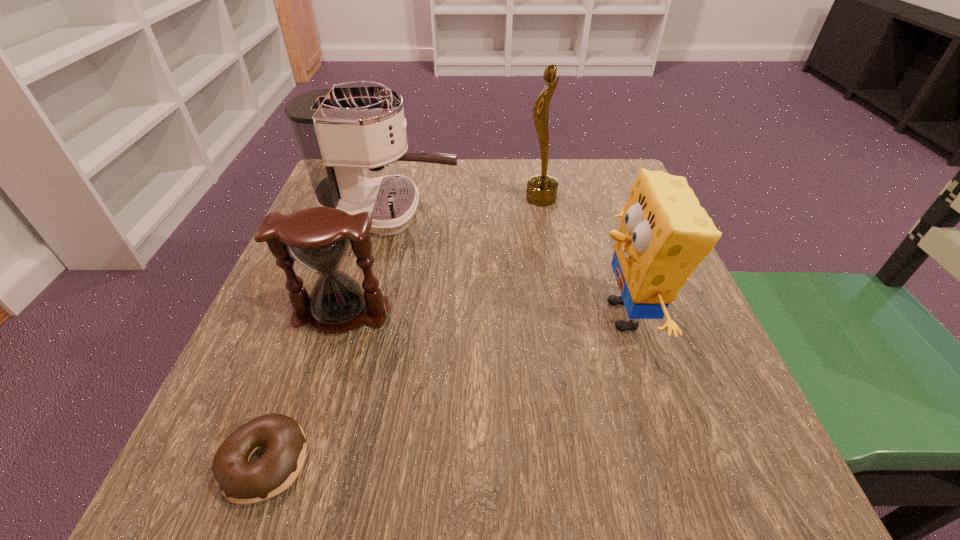
The image size is (960, 540). Find the location of `the second object from right to left`. the second object from right to left is located at coordinates (542, 189).

Identify the location of coffee maker. Image resolution: width=960 pixels, height=540 pixels. tap(339, 131).

Locate an element on the screen. The height and width of the screenshot is (540, 960). the rightmost object is located at coordinates (664, 234).

Locate an element on the screen. The height and width of the screenshot is (540, 960). hourglass is located at coordinates (318, 238).

The width and height of the screenshot is (960, 540). I want to click on the shortest object, so click(241, 482).

Locate an element on the screen. doughnut is located at coordinates (241, 482).

Where is `vacant space located on the front-facing side of the award`? This screenshot has width=960, height=540. vacant space located on the front-facing side of the award is located at coordinates 381,199.

Where is `blank space located 0.360m on the front-facing side of the award`? The height and width of the screenshot is (540, 960). blank space located 0.360m on the front-facing side of the award is located at coordinates (373, 199).

At what (x,y) coordinates should I click in order to perform the action: click on vacant position located on the front-facing side of the award. Please return your answer as a coordinate pair (x, y). Looking at the image, I should click on (416, 199).

Locate an element on the screen. vacant space located on the front-facing side of the coffee maker is located at coordinates (530, 212).